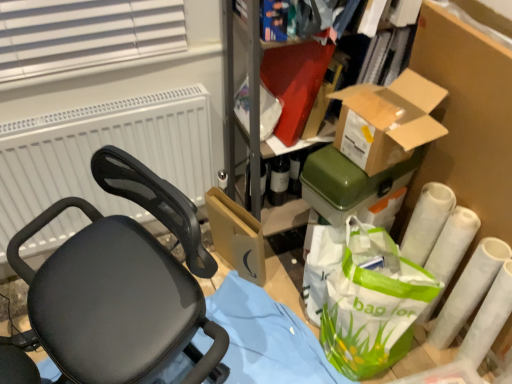
Question: In the image, is black mesh chair at left positioned in front of or behind brown cardboard box at upper right, acting as the 1th box starting from the front?

Choices:
 (A) front
 (B) behind

Answer: (A)

Question: Considering the positions of black mesh chair at left and brown cardboard box at upper right, marked as the second box in a back-to-front arrangement, in the image, is black mesh chair at left taller or shorter than brown cardboard box at upper right, marked as the second box in a back-to-front arrangement,?

Choices:
 (A) short
 (B) tall

Answer: (B)

Question: Estimate the real-world distances between objects in this image. Which object is farther from the green plastic bag at right?

Choices:
 (A) white matte radiator at upper left
 (B) brown cardboard box at upper right, acting as the 1th box starting from the front
 (C) white matte toilet paper at lower right, the 1th toilet paper when ordered from right to left
 (D) white matte toilet paper at lower right, acting as the 2th toilet paper starting from the right
 (E) black mesh chair at left

Answer: (A)

Question: Which is farther from the white matte toilet paper at lower right, acting as the 2th toilet paper starting from the right?

Choices:
 (A) black mesh chair at left
 (B) brown cardboard box at upper right, acting as the 1th box starting from the front
 (C) green plastic container at upper right, which is the 1th box from back to front
 (D) white matte radiator at upper left
 (E) green plastic bag at right

Answer: (D)